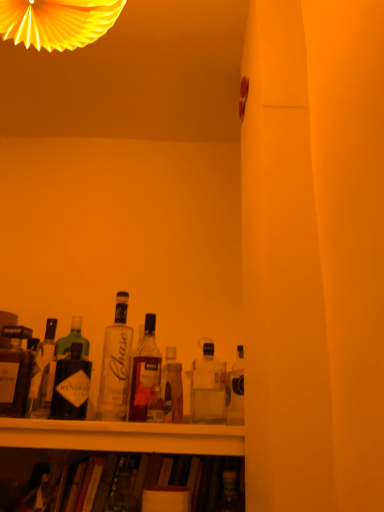
Question: Is translucent glass bottle at center, acting as the third bottle starting from the right, closer to camera compared to matte black bottle at left, the 1th bottle viewed from the left?

Choices:
 (A) yes
 (B) no

Answer: (B)

Question: Does translucent glass bottle at center, marked as the 4th bottle in a left-to-right arrangement, contain matte black bottle at left, the 1th bottle viewed from the left?

Choices:
 (A) yes
 (B) no

Answer: (B)

Question: Could you tell me if translucent glass bottle at center, marked as the 4th bottle in a left-to-right arrangement, is facing matte black bottle at left, marked as the 6th bottle in a right-to-left arrangement?

Choices:
 (A) yes
 (B) no

Answer: (B)

Question: Is translucent glass bottle at center, marked as the 4th bottle in a left-to-right arrangement, located outside matte black bottle at left, the 1th bottle viewed from the left?

Choices:
 (A) yes
 (B) no

Answer: (A)

Question: Can you confirm if translucent glass bottle at center, marked as the 4th bottle in a left-to-right arrangement, is thinner than matte black bottle at left, marked as the 6th bottle in a right-to-left arrangement?

Choices:
 (A) yes
 (B) no

Answer: (A)

Question: From the image's perspective, is translucent glass bottle at center, arranged as the 2th bottle when viewed from the right, positioned above or below clear glass bottle at center, which is the sixth bottle in left-to-right order?

Choices:
 (A) below
 (B) above

Answer: (A)

Question: Considering their positions, is translucent glass bottle at center, positioned as the 5th bottle in left-to-right order, located in front of or behind clear glass bottle at center, which is the sixth bottle in left-to-right order?

Choices:
 (A) front
 (B) behind

Answer: (B)

Question: Is point (180, 419) positioned closer to the camera than point (193, 366)?

Choices:
 (A) farther
 (B) closer

Answer: (B)

Question: Is translucent glass bottle at center, arranged as the 2th bottle when viewed from the right, to the left or to the right of clear glass bottle at center, which is the sixth bottle in left-to-right order, in the image?

Choices:
 (A) right
 (B) left

Answer: (B)

Question: Considering their positions, is translucent glass bottle at center, acting as the third bottle starting from the right, located in front of or behind clear glass bottle at center, which is the 3th bottle from left to right?

Choices:
 (A) behind
 (B) front

Answer: (A)

Question: From their relative heights in the image, would you say translucent glass bottle at center, marked as the 4th bottle in a left-to-right arrangement, is taller or shorter than clear glass bottle at center, which is the 3th bottle from left to right?

Choices:
 (A) tall
 (B) short

Answer: (B)

Question: From a real-world perspective, relative to clear glass bottle at center, which is the 3th bottle from left to right, is translucent glass bottle at center, marked as the 4th bottle in a left-to-right arrangement, vertically above or below?

Choices:
 (A) above
 (B) below

Answer: (B)

Question: From the image's perspective, relative to clear glass bottle at center, which is the 3th bottle from left to right, is translucent glass bottle at center, marked as the 4th bottle in a left-to-right arrangement, above or below?

Choices:
 (A) above
 (B) below

Answer: (B)

Question: From the image's perspective, is translucent glass bottle at center, marked as the 4th bottle in a left-to-right arrangement, positioned above or below matte black bottle at left, the 1th bottle viewed from the left?

Choices:
 (A) above
 (B) below

Answer: (B)

Question: From a real-world perspective, relative to matte black bottle at left, the 1th bottle viewed from the left, is translucent glass bottle at center, acting as the third bottle starting from the right, vertically above or below?

Choices:
 (A) above
 (B) below

Answer: (A)